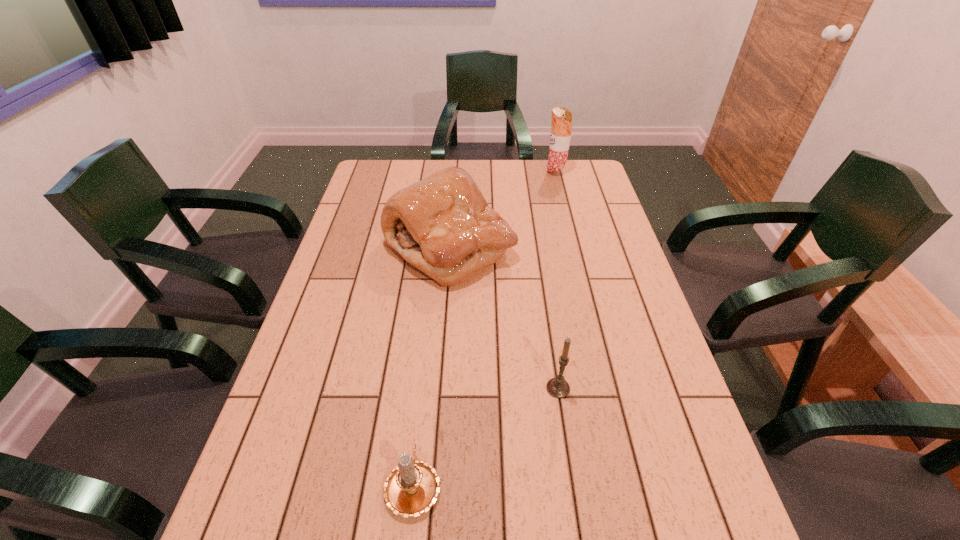
Identify the location of blank space located on the front of the farther candle. This screenshot has height=540, width=960. (578, 521).

This screenshot has height=540, width=960. What are the coordinates of `free space located 0.330m on the right of the shorter candle` in the screenshot? It's located at (613, 484).

The image size is (960, 540). Identify the location of object situated at the far edge. (561, 126).

At what (x,y) coordinates should I click in order to perform the action: click on object that is at the left edge. Please return your answer as a coordinate pair (x, y). Looking at the image, I should click on (442, 225).

What are the coordinates of `object present at the right edge` in the screenshot? It's located at [x=561, y=126].

This screenshot has width=960, height=540. What are the coordinates of `object present at the far right corner` in the screenshot? It's located at (561, 126).

At what (x,y) coordinates should I click in order to perform the action: click on free space at the far edge. Please return your answer as a coordinate pair (x, y). Looking at the image, I should click on (417, 163).

Where is `blank space at the left edge of the desktop`? The height and width of the screenshot is (540, 960). blank space at the left edge of the desktop is located at coordinates (311, 310).

Image resolution: width=960 pixels, height=540 pixels. Find the location of `free spot at the right edge of the desktop`. free spot at the right edge of the desktop is located at coordinates (609, 334).

This screenshot has width=960, height=540. I want to click on vacant space at the far left corner of the desktop, so click(395, 186).